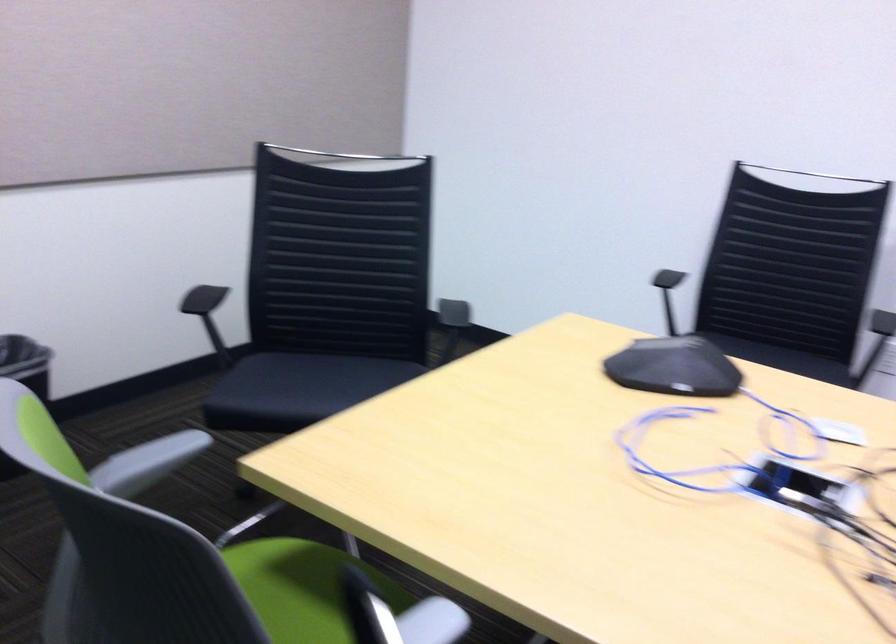
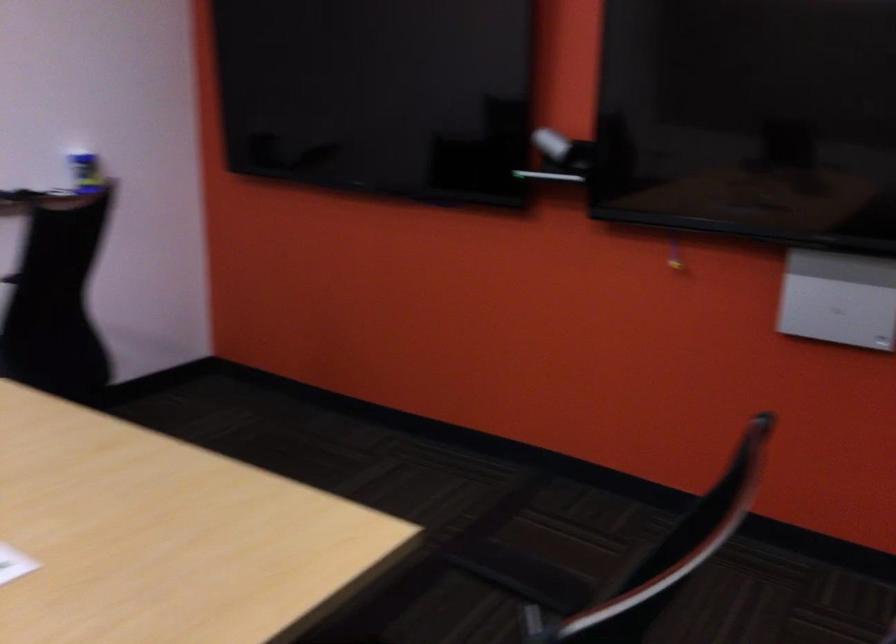
The images are taken continuously from a first-person perspective. In which direction is your viewpoint rotating?

The camera rotated toward right-down.